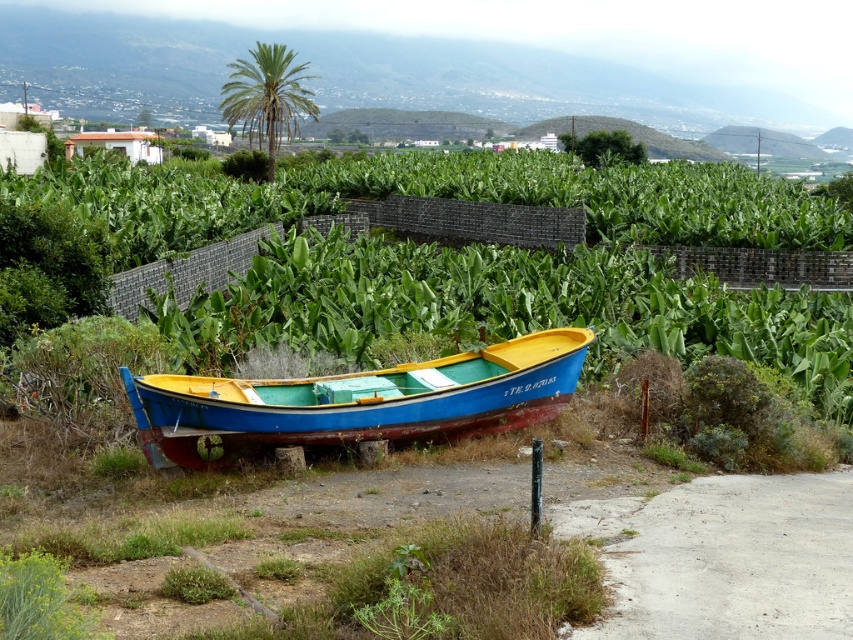
Question: Is blue wooden boat at center wider than green leafy palm at upper center?

Choices:
 (A) no
 (B) yes

Answer: (A)

Question: Can you confirm if blue wooden boat at center is positioned to the right of green leafy palm at upper center?

Choices:
 (A) no
 (B) yes

Answer: (B)

Question: Is blue wooden boat at center wider than green leafy palm at upper center?

Choices:
 (A) no
 (B) yes

Answer: (A)